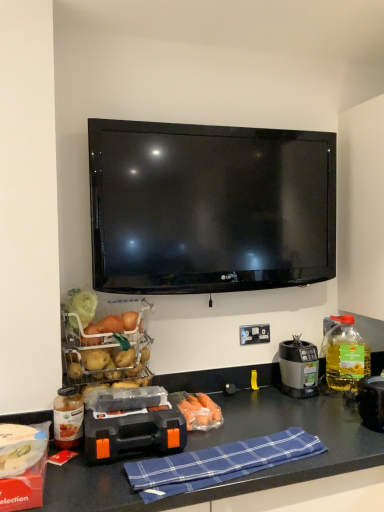
Question: Is translucent glass jar at lower left, the first bottle in the front-to-back sequence, behind matte red box at lower left?

Choices:
 (A) no
 (B) yes

Answer: (B)

Question: Considering the relative sizes of translucent glass jar at lower left, the 1th bottle in the left-to-right sequence, and matte red box at lower left in the image provided, is translucent glass jar at lower left, the 1th bottle in the left-to-right sequence, wider than matte red box at lower left?

Choices:
 (A) no
 (B) yes

Answer: (A)

Question: Can you confirm if translucent glass jar at lower left, the first bottle in the front-to-back sequence, is smaller than matte red box at lower left?

Choices:
 (A) yes
 (B) no

Answer: (A)

Question: Can you confirm if translucent glass jar at lower left, which appears as the 2th bottle when viewed from the back, is positioned to the right of matte red box at lower left?

Choices:
 (A) no
 (B) yes

Answer: (B)

Question: Can you confirm if translucent glass jar at lower left, the first bottle in the front-to-back sequence, is bigger than matte red box at lower left?

Choices:
 (A) yes
 (B) no

Answer: (B)

Question: Looking at the image, does translucent glass jar at lower left, the 1th bottle in the left-to-right sequence, seem bigger or smaller compared to orange plastic toolbox at center?

Choices:
 (A) big
 (B) small

Answer: (B)

Question: Is translucent glass jar at lower left, the first bottle in the front-to-back sequence, to the left or to the right of orange plastic toolbox at center in the image?

Choices:
 (A) right
 (B) left

Answer: (B)

Question: From their relative heights in the image, would you say translucent glass jar at lower left, the first bottle in the front-to-back sequence, is taller or shorter than orange plastic toolbox at center?

Choices:
 (A) tall
 (B) short

Answer: (A)

Question: Considering their positions, is translucent glass jar at lower left, which appears as the 2th bottle when viewed from the back, located in front of or behind orange plastic toolbox at center?

Choices:
 (A) front
 (B) behind

Answer: (B)

Question: Do you think matte red box at lower left is within orange translucent carrots at center, or outside of it?

Choices:
 (A) outside
 (B) inside

Answer: (A)

Question: Based on their sizes in the image, would you say matte red box at lower left is bigger or smaller than orange translucent carrots at center?

Choices:
 (A) small
 (B) big

Answer: (B)

Question: Considering the positions of matte red box at lower left and orange translucent carrots at center in the image, is matte red box at lower left taller or shorter than orange translucent carrots at center?

Choices:
 (A) short
 (B) tall

Answer: (B)

Question: Considering the positions of matte red box at lower left and orange translucent carrots at center in the image, is matte red box at lower left wider or thinner than orange translucent carrots at center?

Choices:
 (A) thin
 (B) wide

Answer: (B)

Question: Is black plastic blender at right bigger or smaller than orange plastic toolbox at center?

Choices:
 (A) big
 (B) small

Answer: (B)

Question: Would you say black plastic blender at right is to the left or to the right of orange plastic toolbox at center in the picture?

Choices:
 (A) left
 (B) right

Answer: (B)